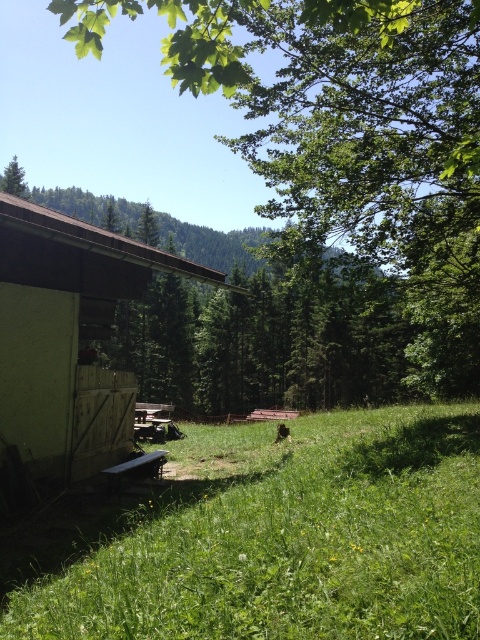
Which is below, green leafy tree at upper left or wooden picnic table at lower center?

wooden picnic table at lower center is lower down.

Can you confirm if green leafy tree at upper left is positioned to the left of wooden picnic table at lower center?

In fact, green leafy tree at upper left is to the right of wooden picnic table at lower center.

What do you see at coordinates (350, 141) in the screenshot?
I see `green leafy tree at upper left` at bounding box center [350, 141].

Identify the location of green leafy tree at upper left. (350, 141).

From the picture: Can you confirm if green grassy field at lower left is taller than wooden picnic table at lower center?

Yes, green grassy field at lower left is taller than wooden picnic table at lower center.

Is green grassy field at lower left closer to the viewer compared to wooden picnic table at lower center?

Yes, green grassy field at lower left is closer to the viewer.

Which is behind, point (367, 604) or point (144, 417)?

The point (144, 417) is more distant.

The image size is (480, 640). Identify the location of green grassy field at lower left. (290, 540).

In the scene shown: Between green leafy tree at upper left and green matte tree at upper left, which one has more height?

green leafy tree at upper left

The width and height of the screenshot is (480, 640). What do you see at coordinates (350, 141) in the screenshot? I see `green leafy tree at upper left` at bounding box center [350, 141].

Is point (324, 227) less distant than point (14, 168)?

That is True.

You are a GUI agent. You are given a task and a screenshot of the screen. Output one action in this format:
    pyautogui.click(x=<x>, y=<y>)
    Task: Click on the green leafy tree at upper left
    Image resolution: width=480 pixels, height=640 pixels.
    Given the screenshot: What is the action you would take?
    [350, 141]